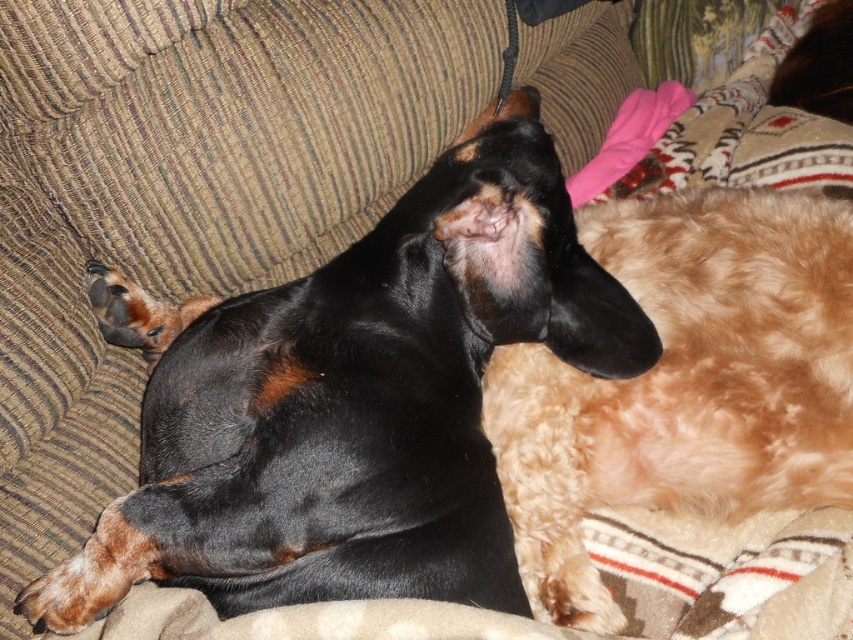
Does point (345, 557) come farther from viewer compared to point (666, 307)?

No, (345, 557) is in front of (666, 307).

Does black smooth dog at center appear over fuzzy brown dog at upper right?

Correct, black smooth dog at center is located above fuzzy brown dog at upper right.

Between point (148, 460) and point (492, 356), which one is positioned in front?

Positioned in front is point (148, 460).

Find the location of `black smooth dog at center`. black smooth dog at center is located at coordinates (352, 401).